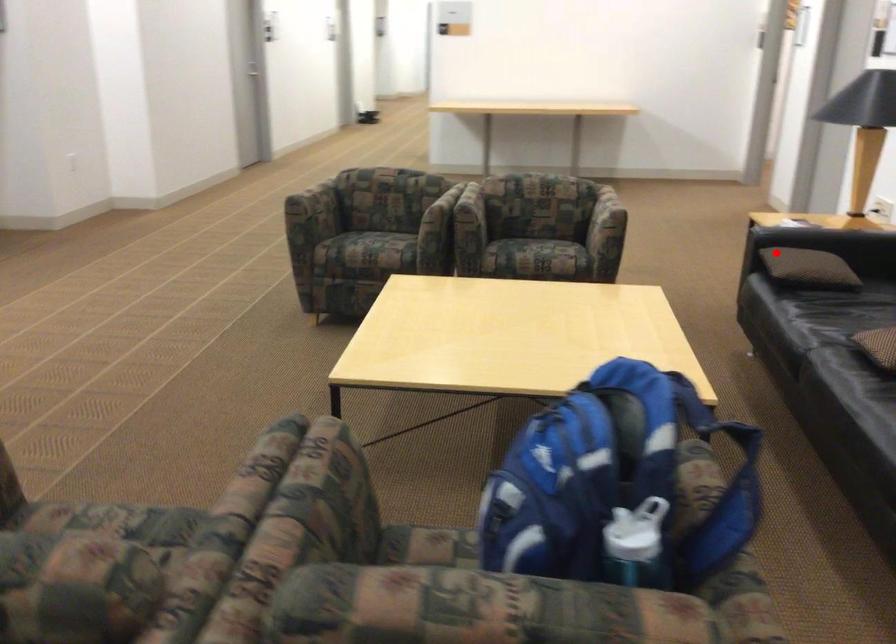
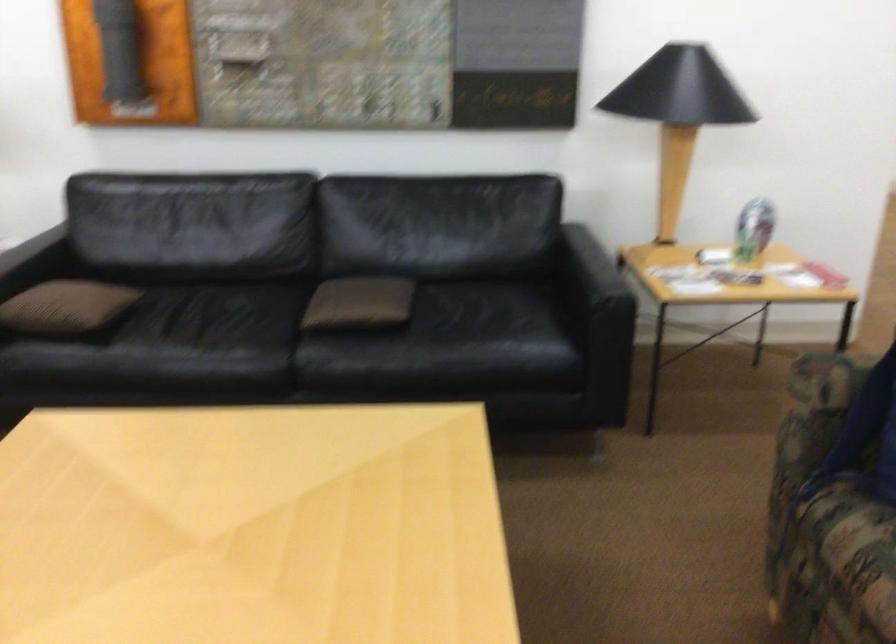
Question: I am providing you with two images of the same scene from different viewpoints. A red point is marked on the first image. At the location where the point appears in image 1, is it still visible in image 2?

Choices:
 (A) Yes
 (B) No

Answer: (A)